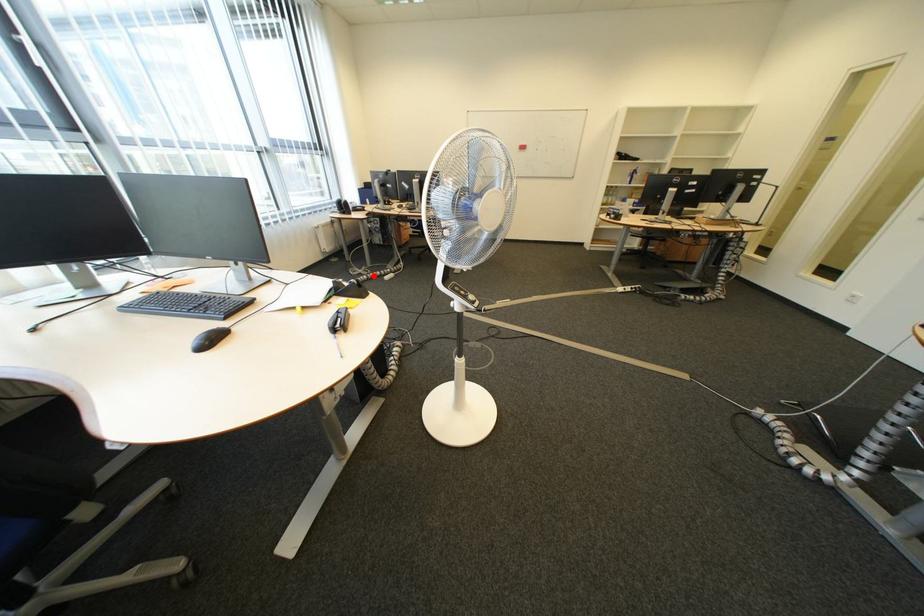
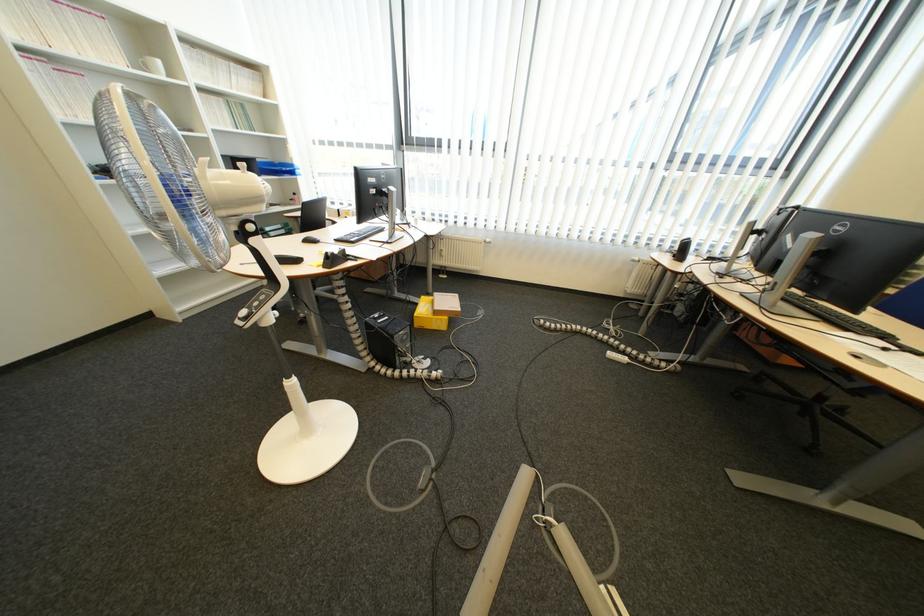
Locate, in the second image, the point that corresponds to the highlighted location in the first image.

(619, 331)